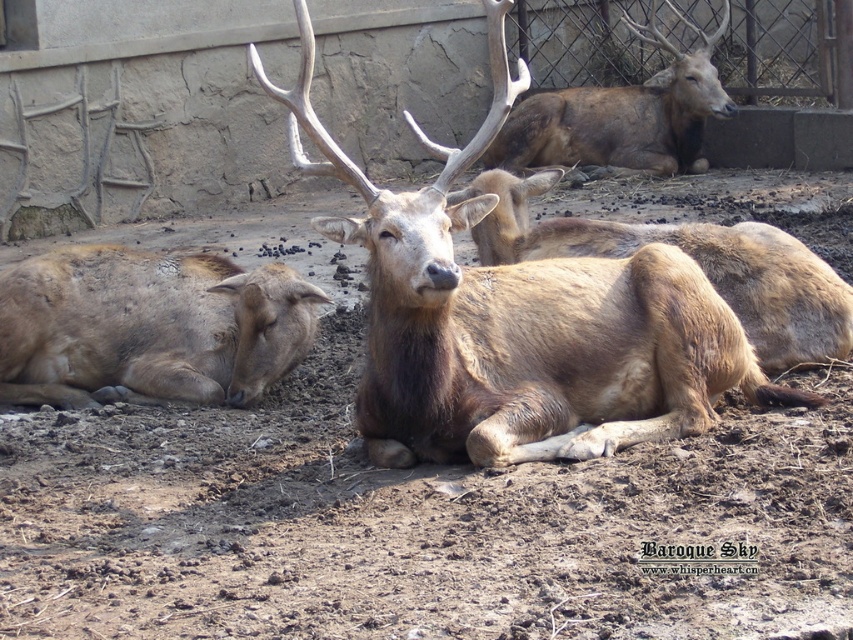
Is brown fuzzy deer at lower left shorter than brown furry deer at upper center?

Correct, brown fuzzy deer at lower left is not as tall as brown furry deer at upper center.

Does point (32, 301) come farther from viewer compared to point (607, 99)?

No, (32, 301) is in front of (607, 99).

Based on the photo, who is more distant from viewer, (114, 355) or (514, 148)?

The point (514, 148) is behind.

This screenshot has width=853, height=640. I want to click on brown fuzzy deer at lower left, so click(x=148, y=326).

Between brown fuzzy deer at center and brown furry deer at upper center, which one has more height?

Standing taller between the two is brown furry deer at upper center.

Is point (706, 237) positioned before point (585, 156)?

Yes, it is in front of point (585, 156).

Find the location of a particular element. The image size is (853, 640). brown fuzzy deer at center is located at coordinates (693, 259).

Is brown furry deer at center below brown fuzzy deer at lower left?

No, brown furry deer at center is not below brown fuzzy deer at lower left.

Does point (543, 284) come in front of point (135, 301)?

Yes, point (543, 284) is closer to viewer.

Describe the element at coordinates (518, 320) in the screenshot. I see `brown furry deer at center` at that location.

This screenshot has width=853, height=640. Identify the location of brown furry deer at center. (518, 320).